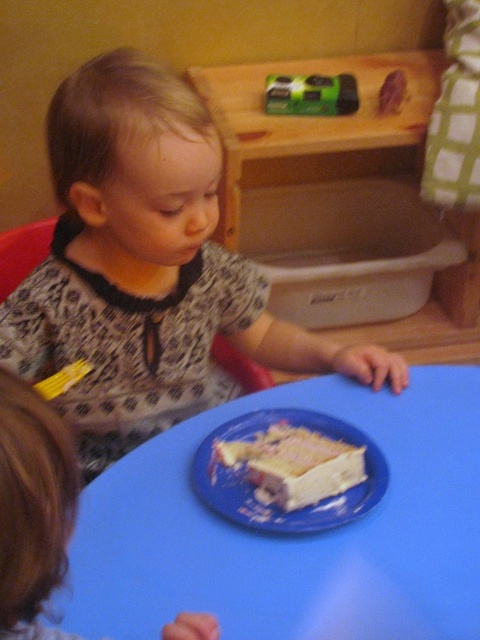
In the scene shown: You are a parent trying to ensure your child reaches the white frosted cake at center without touching the matte black shirt at upper left. Can the child safely reach the cake without touching the shirt?

The distance between the matte black shirt at upper left and the white frosted cake at center is 11.45 inches, so the child can safely reach the cake without touching the shirt.

You are a photographer setting up a shoot. You need to position a light source to the right of the blue plastic table at center but also ensure it doesn t block the matte black shirt at upper left. Based on their positions, where should you place the light source?

The matte black shirt at upper left is to the left of the blue plastic table at center. Therefore, placing the light source to the right of the blue plastic table at center would not block the matte black shirt at upper left since it is positioned to the left of the table.